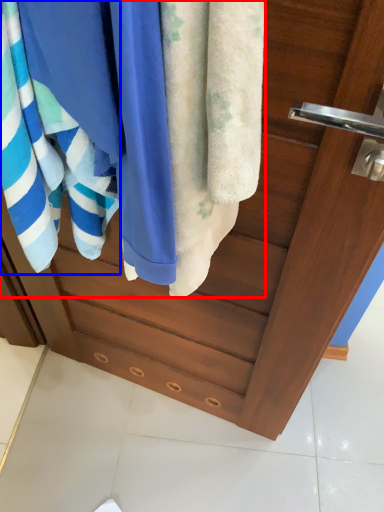
Question: Which point is closer to the camera, beach towel (highlighted by a red box) or towel (highlighted by a blue box)?

Choices:
 (A) beach towel
 (B) towel

Answer: (B)